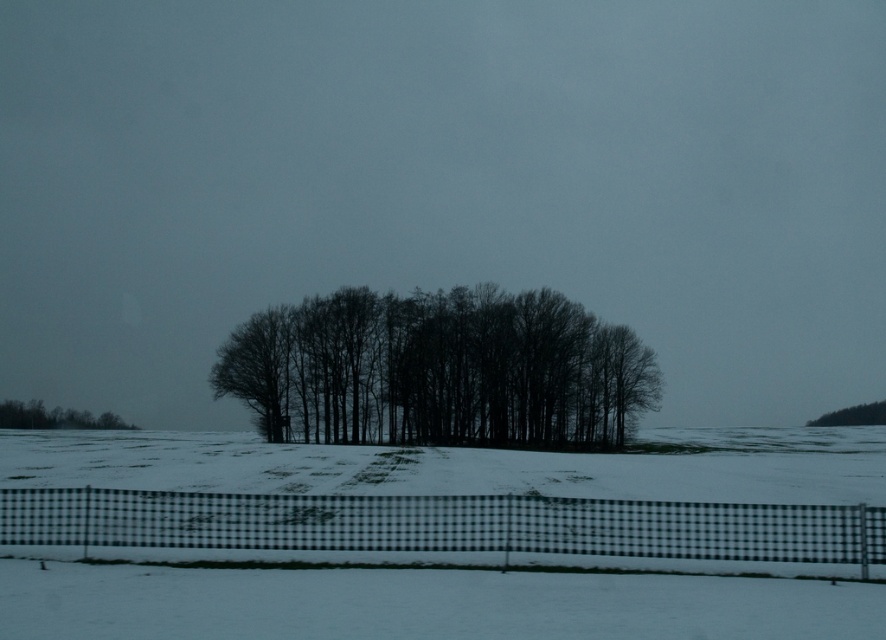
Between black matte trees at center and smooth brown tree at right, which one has more height?

black matte trees at center is taller.

Between black matte trees at center and smooth brown tree at right, which one appears on the right side from the viewer's perspective?

From the viewer's perspective, smooth brown tree at right appears more on the right side.

Describe the element at coordinates (439, 369) in the screenshot. Image resolution: width=886 pixels, height=640 pixels. I see `black matte trees at center` at that location.

This screenshot has width=886, height=640. Identify the location of black matte trees at center. (439, 369).

Between black checkered fence at lower center and green matte trees at lower left, which one has more height?

Standing taller between the two is green matte trees at lower left.

Find the location of a particular element. This screenshot has width=886, height=640. black checkered fence at lower center is located at coordinates (438, 525).

Is white powdery snow at center positioned before smooth brown tree at right?

Yes.

Does white powdery snow at center appear on the right side of smooth brown tree at right?

In fact, white powdery snow at center is to the left of smooth brown tree at right.

Is point (507, 490) farther from camera compared to point (850, 419)?

That is False.

The width and height of the screenshot is (886, 640). I want to click on white powdery snow at center, so click(421, 604).